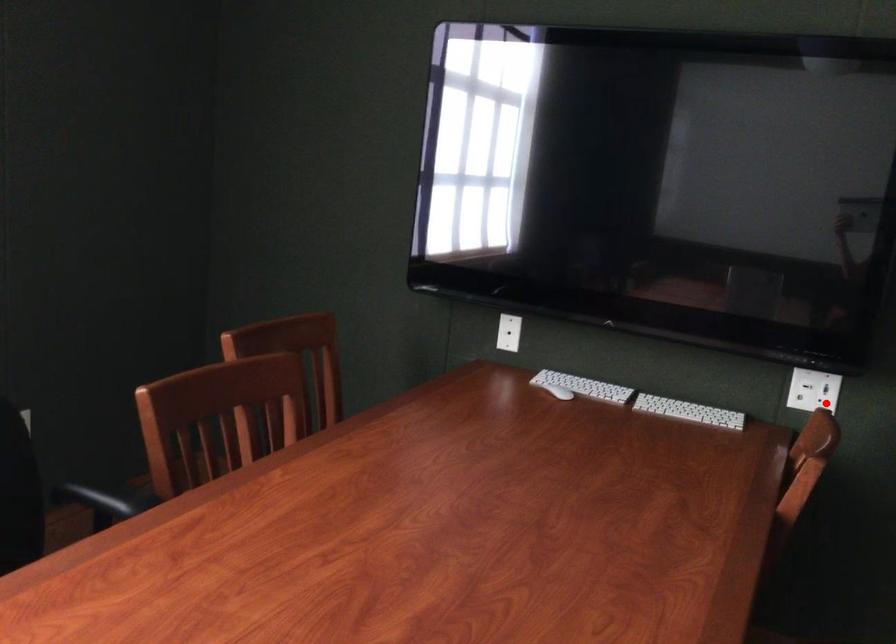
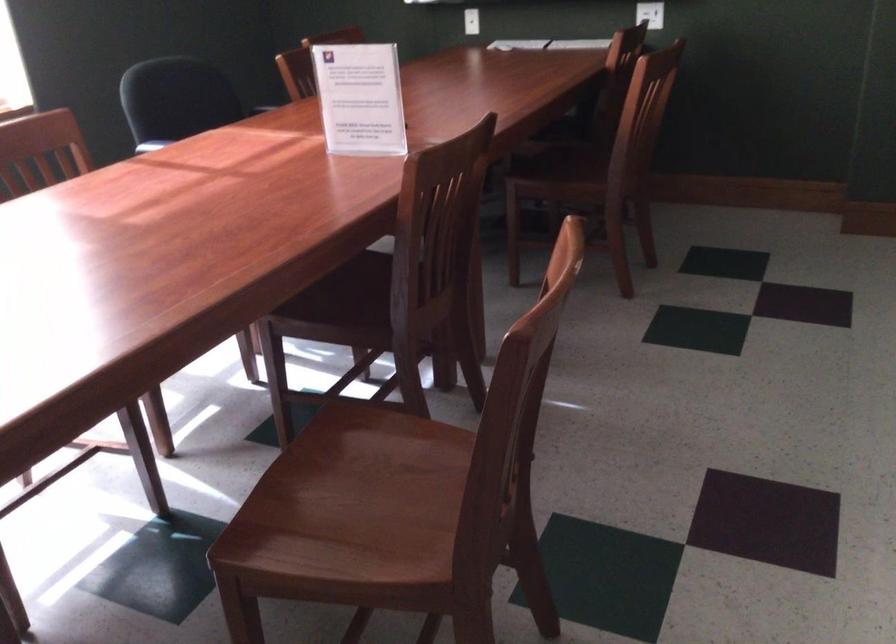
Question: I am providing you with two images of the same scene from different viewpoints. In image1, a red point is highlighted. Considering the same 3D point in image2, which of the following is correct?

Choices:
 (A) It is closer
 (B) It is farther

Answer: (B)